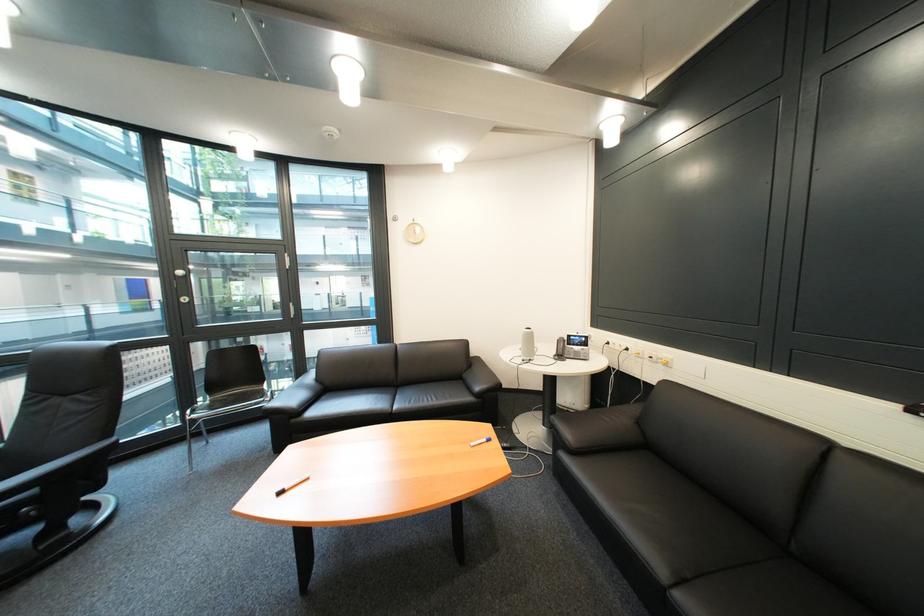
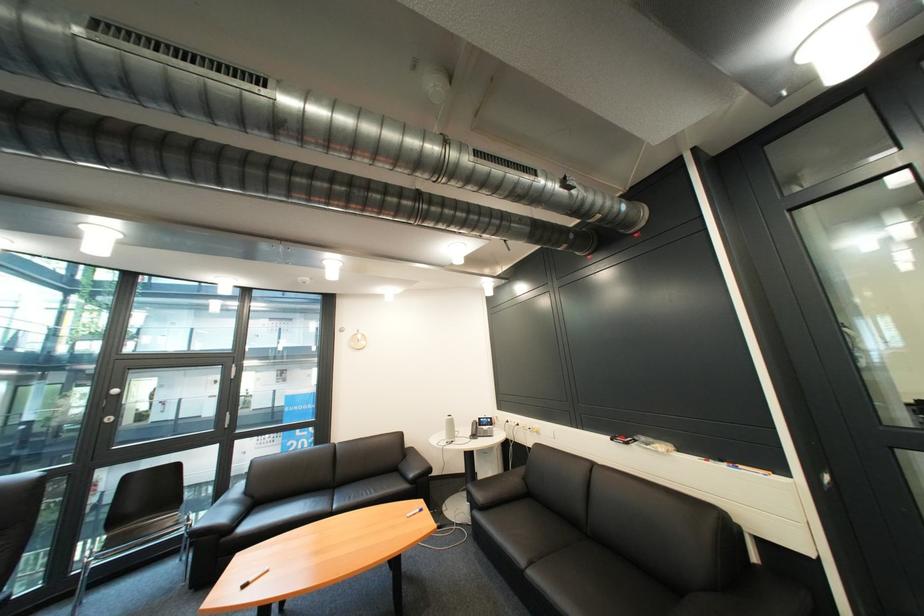
Where in the second image is the point corresponding to point (580, 445) from the first image?

(491, 504)